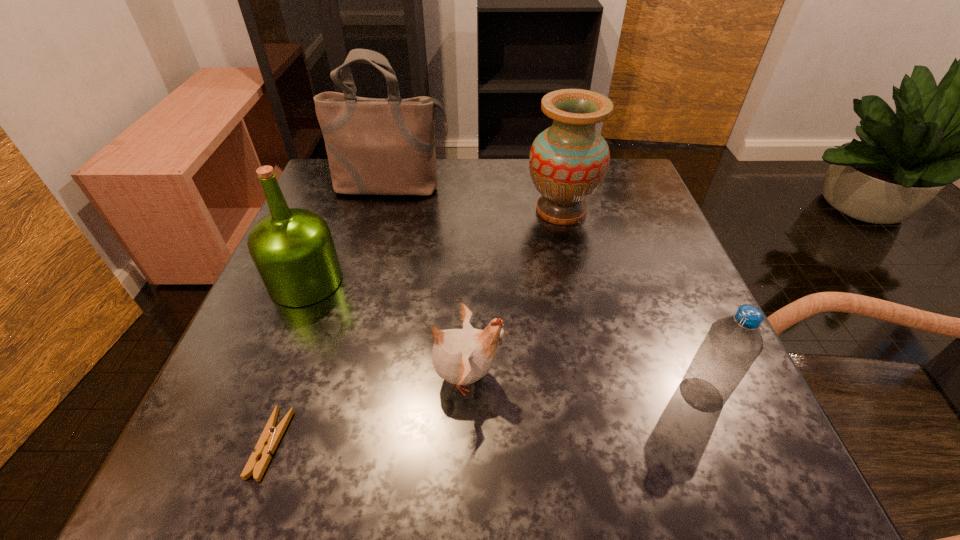
Image resolution: width=960 pixels, height=540 pixels. In order to click on vacant point located between the olive oil and the shortest object in this screenshot , I will do `click(288, 363)`.

Identify the location of object that is the fourth closest to the olive oil. The height and width of the screenshot is (540, 960). (568, 162).

The width and height of the screenshot is (960, 540). Find the location of `object that ranks as the second closest to the water bottle`. object that ranks as the second closest to the water bottle is located at coordinates (568, 162).

Find the location of a particular element. This screenshot has height=540, width=960. free region that satisfies the following two spatial constraints: 1. on the front side of the vase; 2. at the beak of the second shortest object is located at coordinates (599, 377).

Image resolution: width=960 pixels, height=540 pixels. In order to click on free spot that satisfies the following two spatial constraints: 1. on the back side of the water bottle; 2. on the left side of the shortest object in this screenshot , I will do `click(288, 394)`.

You are a GUI agent. You are given a task and a screenshot of the screen. Output one action in this format:
    pyautogui.click(x=<x>, y=<y>)
    Task: Click on the free space that satisfies the following two spatial constraints: 1. at the beak of the fifth tallest object; 2. on the left side of the rightmost object
    
    Given the screenshot: What is the action you would take?
    pyautogui.click(x=467, y=394)

I want to click on vacant position in the image that satisfies the following two spatial constraints: 1. on the front-facing side of the water bottle; 2. on the left side of the tallest object, so click(x=338, y=394).